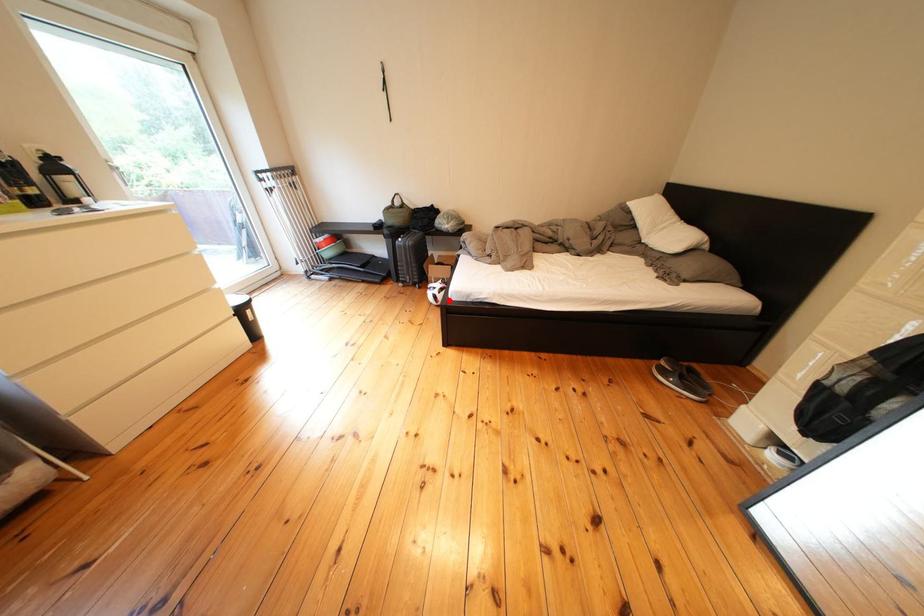
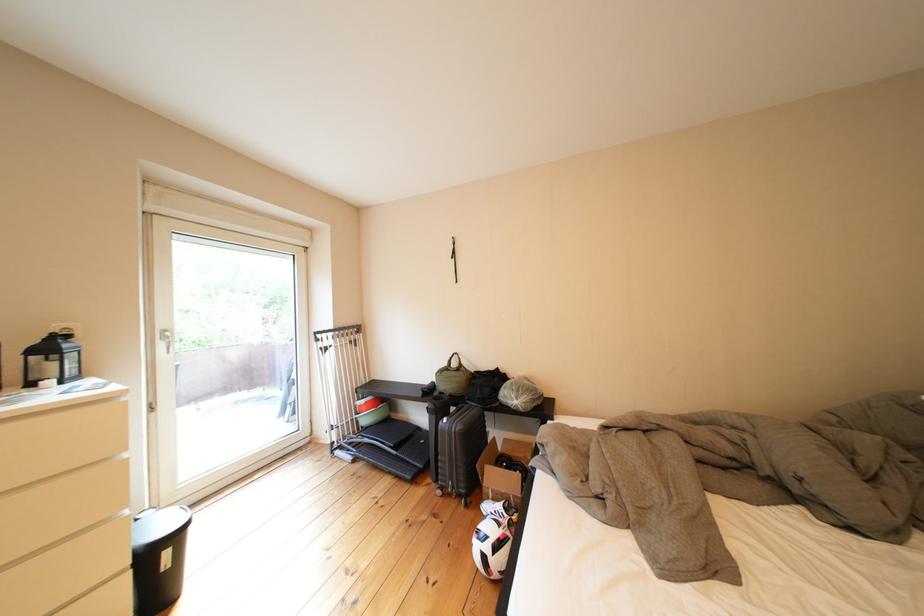
Question: I am providing you with two images of the same scene from different viewpoints. Given a red point in image1, look at the same physical point in image2. Is it:

Choices:
 (A) Closer to the viewpoint
 (B) Farther from the viewpoint

Answer: (A)